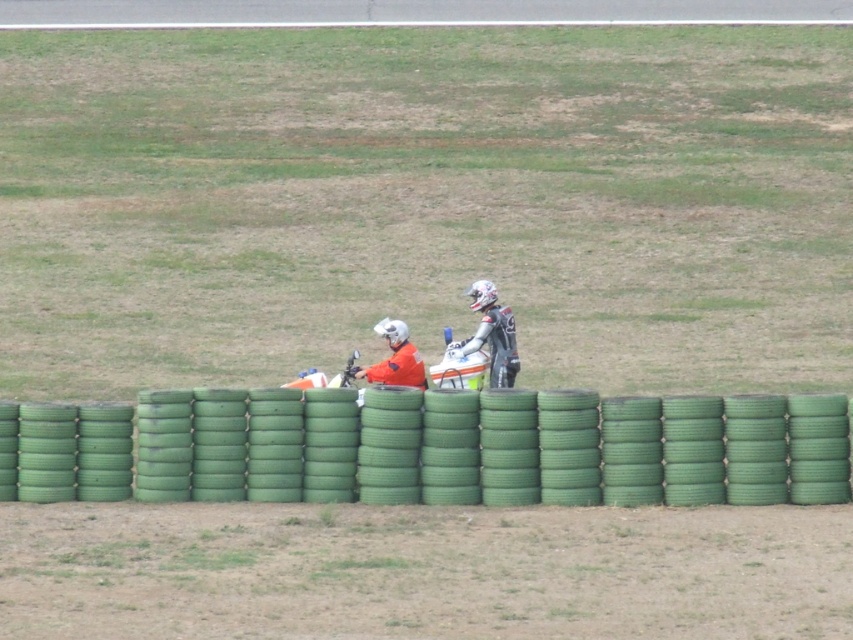
Looking at this image, you are a photographer trying to capture a clear shot of the orange fabric jacket at center while avoiding the green rubber tires at center. Based on their positions, can you tell if the jacket will be mostly visible behind the tires?

The green rubber tires at center are closer to the viewer than the orange fabric jacket at center, so the jacket will be mostly hidden behind the tires and not fully visible.

You are a photographer trying to capture a clear shot of both the white matte motorcycle at center and the orange fabric jacket at center. Since you can only adjust your camera angle slightly, will you be able to see both objects fully without any obstruction?

The orange fabric jacket at center is behind the white matte motorcycle at center, so the motorcycle will block part of the jacket. You won

You are a photographer planning to take a photo of the white matte motorcycle at center and the green rubber tires at center. Since you want to emphasize the motorcycle, which object should you place closer to the camera to make it appear larger in the photo?

To make the white matte motorcycle at center appear larger in the photo, you should place it closer to the camera. However, according to the description, the green rubber tires at center is bigger than the white matte motorcycle at center. Therefore, even if the motorcycle is closer, the tires are inherently larger, so adjusting their positions might not sufficiently emphasize the motorcycle unless the tires are moved further back.